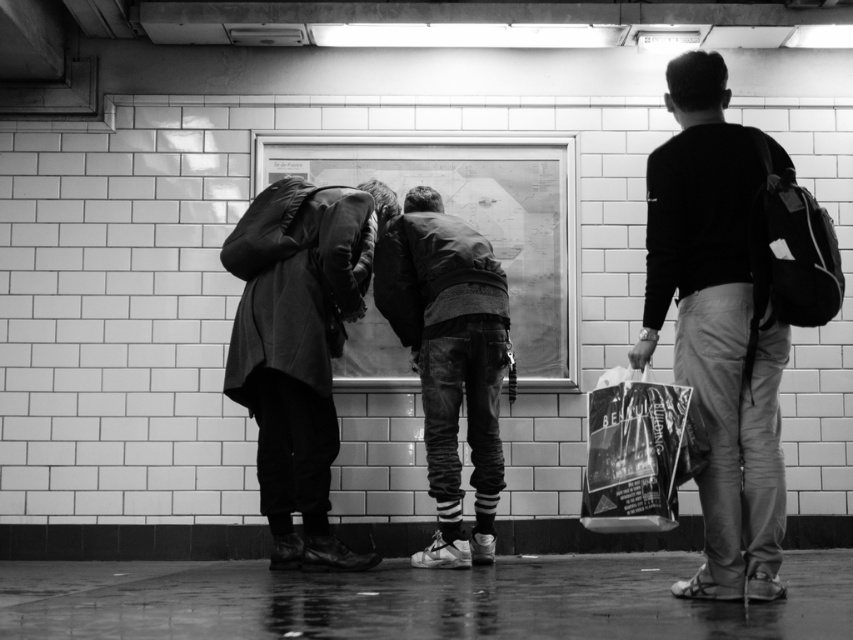
Who is positioned more to the left, dark gray sweater at right or denim jeans at center?

Positioned to the left is denim jeans at center.

Can you confirm if dark gray sweater at right is wider than denim jeans at center?

No, dark gray sweater at right is not wider than denim jeans at center.

Is point (712, 310) farther from viewer compared to point (486, 429)?

No, it is not.

Where is `dark gray sweater at right`? dark gray sweater at right is located at coordinates (717, 328).

In the scene shown: Can you confirm if dark gray sweater at right is positioned to the right of shiny plastic bag at right?

Correct, you'll find dark gray sweater at right to the right of shiny plastic bag at right.

Can you confirm if dark gray sweater at right is positioned above shiny plastic bag at right?

Yes, dark gray sweater at right is above shiny plastic bag at right.

I want to click on dark gray sweater at right, so click(717, 328).

Does cozy woolen coat at center have a lesser height compared to shiny plastic bag at right?

In fact, cozy woolen coat at center may be taller than shiny plastic bag at right.

Between point (231, 371) and point (692, 452), which one is positioned behind?

The point (231, 371) is behind.

You are a GUI agent. You are given a task and a screenshot of the screen. Output one action in this format:
    pyautogui.click(x=<x>, y=<y>)
    Task: Click on the cozy woolen coat at center
    The image size is (853, 640).
    Given the screenshot: What is the action you would take?
    pyautogui.click(x=299, y=346)